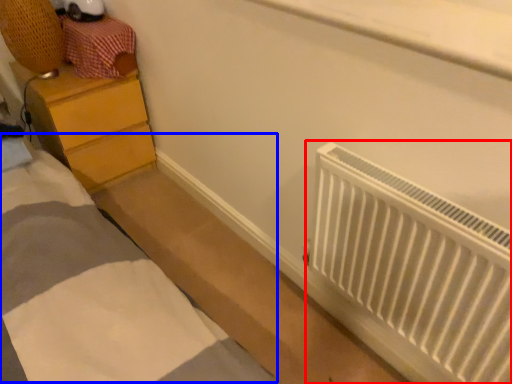
Question: Which of the following is the farthest to the observer, radiator (highlighted by a red box) or bed (highlighted by a blue box)?

Choices:
 (A) radiator
 (B) bed

Answer: (B)